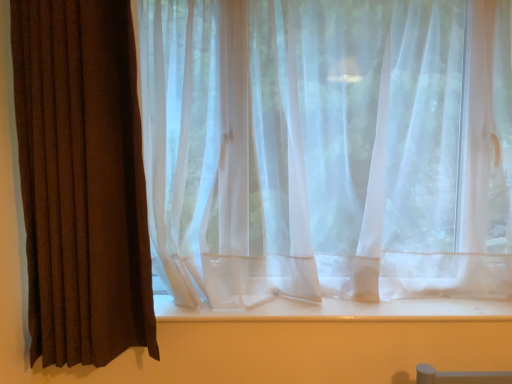
Image resolution: width=512 pixels, height=384 pixels. I want to click on free point below translucent white curtain at center, positioned as the 1th curtain in right-to-left order (from a real-world perspective), so click(317, 297).